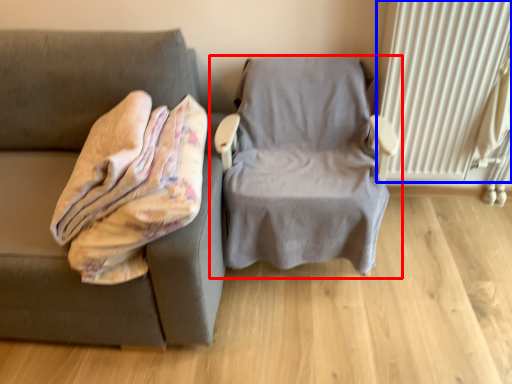
Question: Among these objects, which one is nearest to the camera, chair (highlighted by a red box) or radiator (highlighted by a blue box)?

Choices:
 (A) chair
 (B) radiator

Answer: (A)